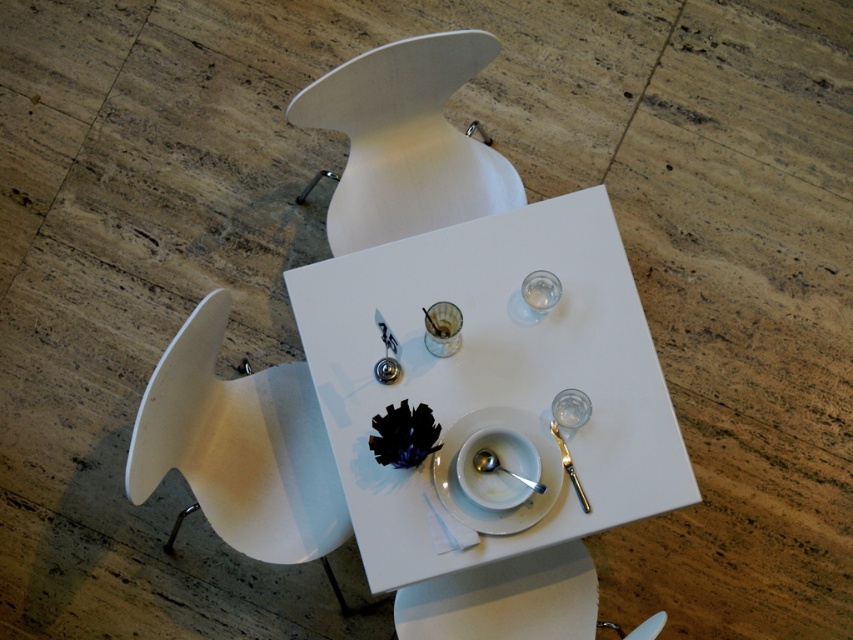
Question: Is white matte plate at center smaller than shiny metallic spoon at center?

Choices:
 (A) no
 (B) yes

Answer: (A)

Question: Is white glossy table at center below white matte chair at upper center?

Choices:
 (A) no
 (B) yes

Answer: (B)

Question: Which point is closer to the camera taking this photo?

Choices:
 (A) (410, 452)
 (B) (149, 396)
 (C) (474, 516)

Answer: (B)

Question: Which point is farther to the camera?

Choices:
 (A) (392, 456)
 (B) (263, 547)
 (C) (540, 476)
 (D) (466, 362)

Answer: (B)

Question: Among these objects, which one is nearest to the camera?

Choices:
 (A) white matte chair at upper center
 (B) shiny metallic spoon at center
 (C) transparent glass wine glass at center

Answer: (B)

Question: From the image, what is the correct spatial relationship of black matte flower at center in relation to transparent glass wine glass at center?

Choices:
 (A) above
 (B) below

Answer: (A)